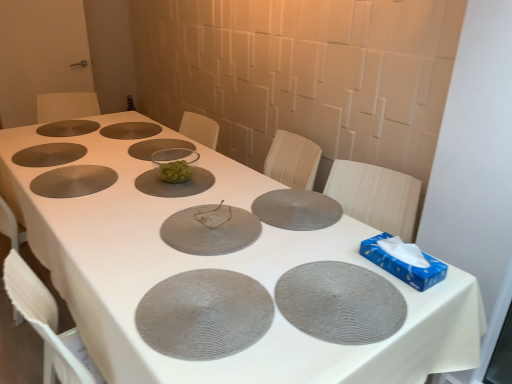
At what (x,y) coordinates should I click in order to perform the action: click on free space in front of transparent glass bowl at center, arranged as the 8th glass plate when viewed from the front. Please return your answer as a coordinate pair (x, y). Looking at the image, I should click on (125, 167).